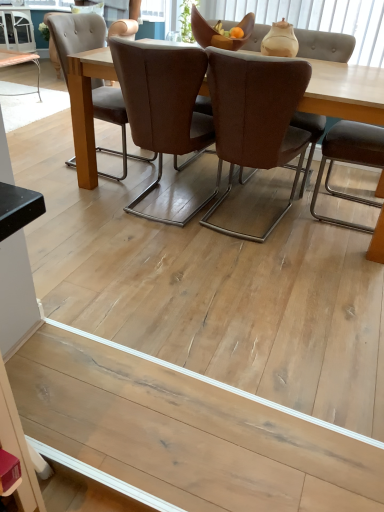
At what (x,y) coordinates should I click in order to perform the action: click on free point in front of brown leather chair at center, positioned as the 3th chair in right-to-left order. Please return your answer as a coordinate pair (x, y). This screenshot has height=512, width=384. Looking at the image, I should click on (162, 247).